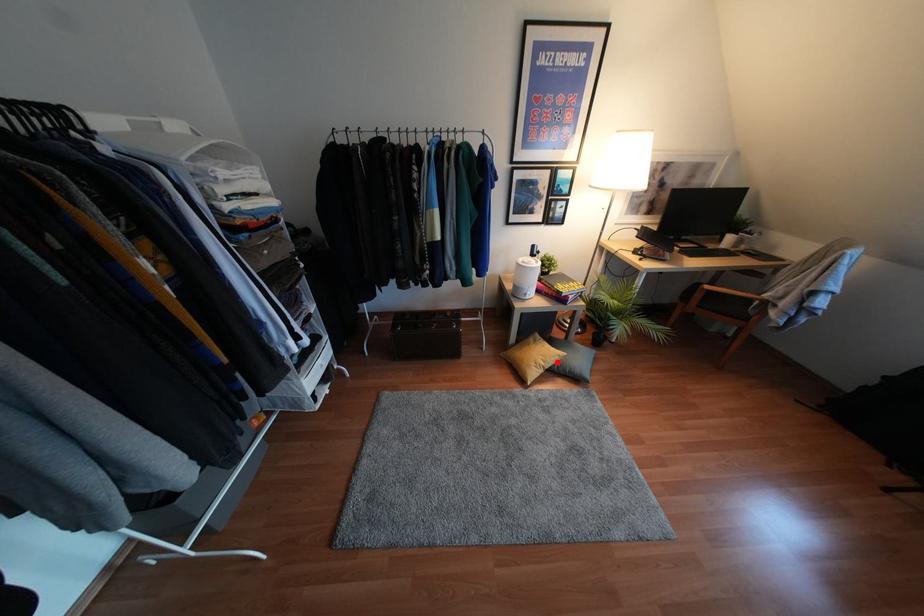
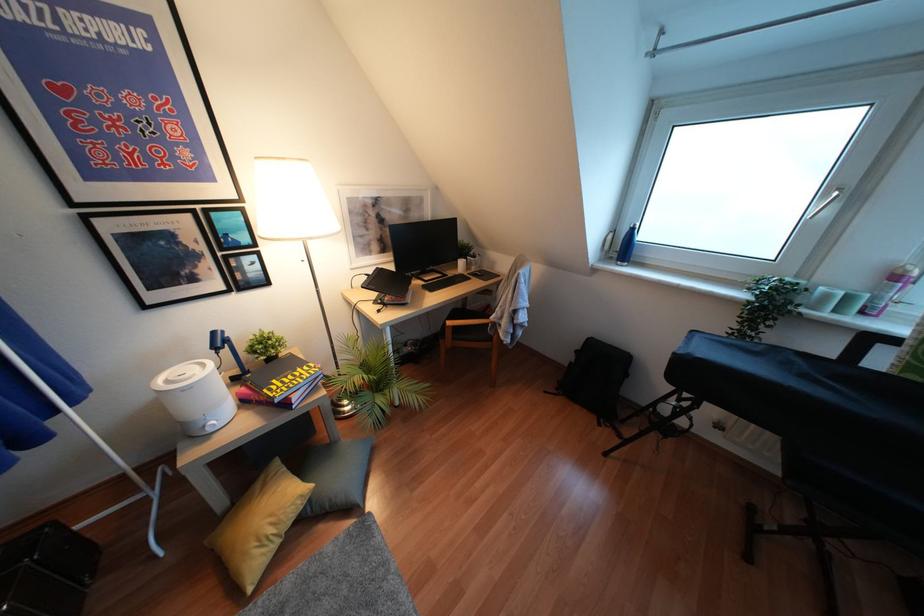
Locate, in the second image, the point that corresponds to the highlighted location in the first image.

(310, 500)